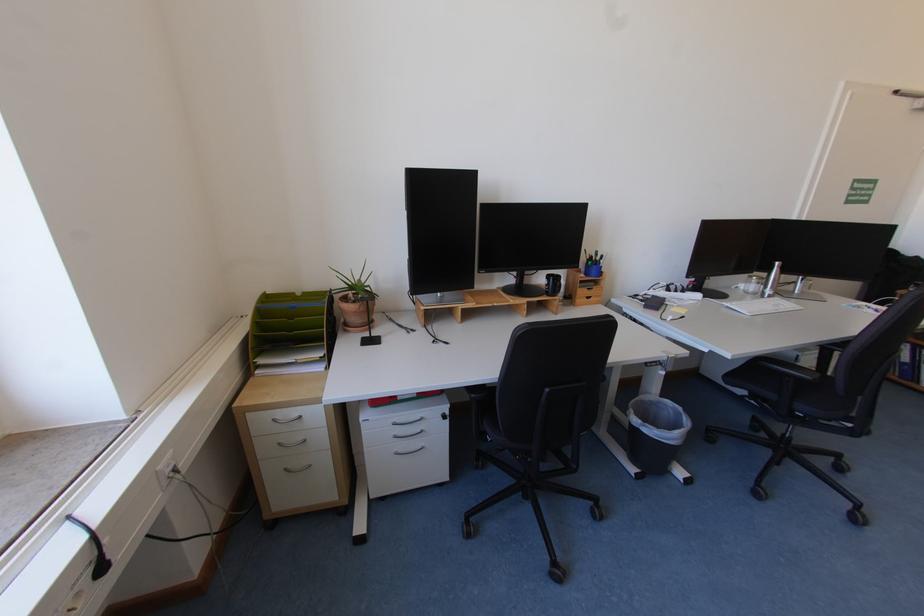
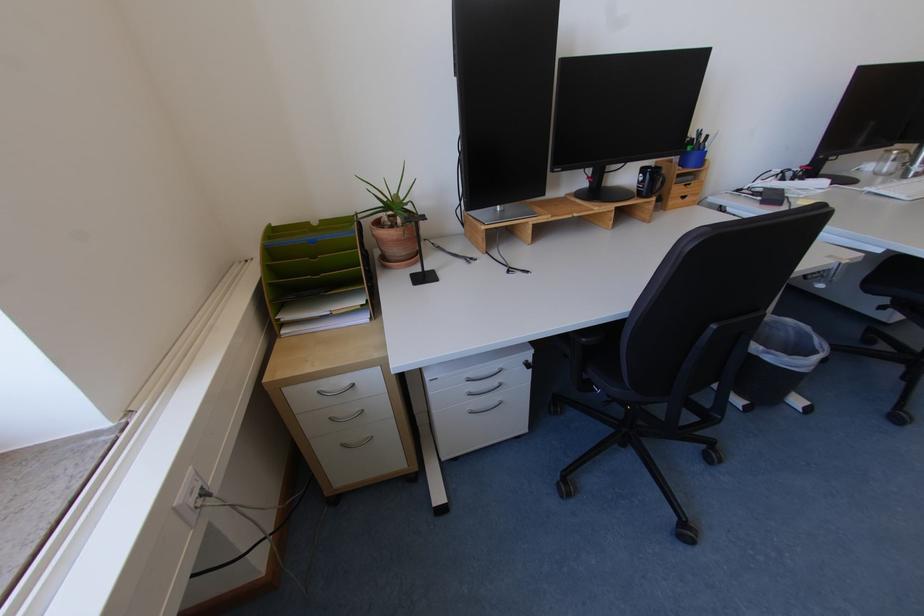
Where in the second image is the point corresponding to [282,421] from the first image?

(327, 392)